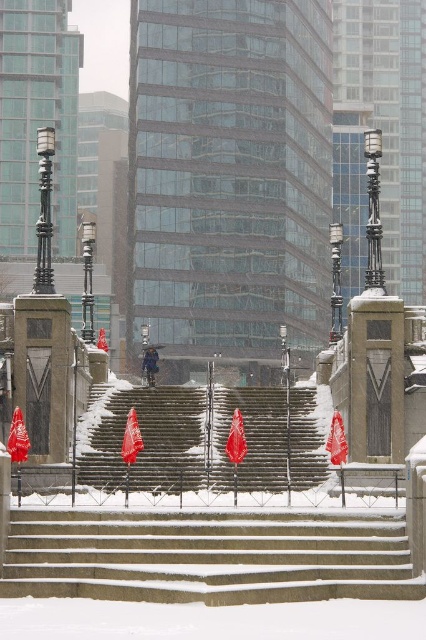
You are standing at the base of the stone steps in the snowy scene. There are two points marked on the image, point A at coordinates point A is point (305, 442) and point B at point (147, 378). Which point is closer to you as you face the steps?

Point A at coordinates point (305, 442) is closer to you because it is in front of point B at point (147, 378).